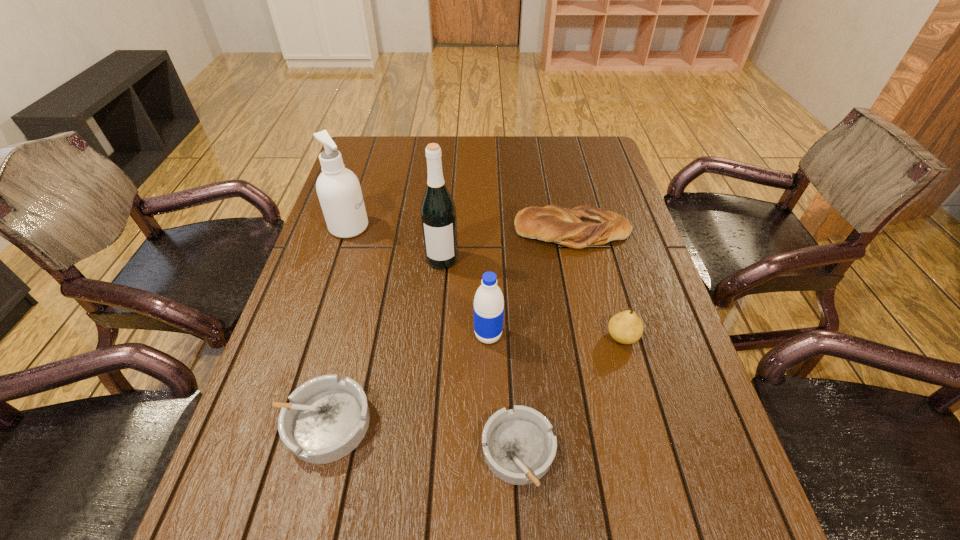
Locate an element on the screen. The width and height of the screenshot is (960, 540). vacant spot to place a ashtray on the right is located at coordinates (732, 484).